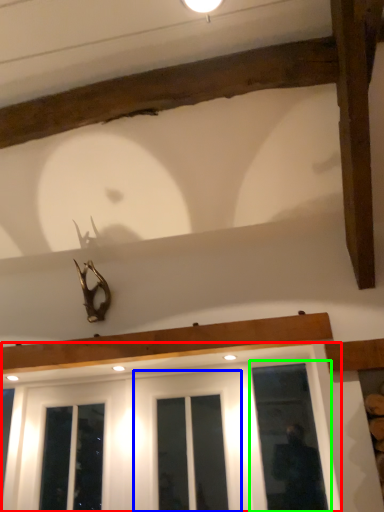
Question: Considering the real-world distances, which object is farthest from window (highlighted by a red box)? screen door (highlighted by a blue box) or window (highlighted by a green box)?

Choices:
 (A) screen door
 (B) window

Answer: (B)